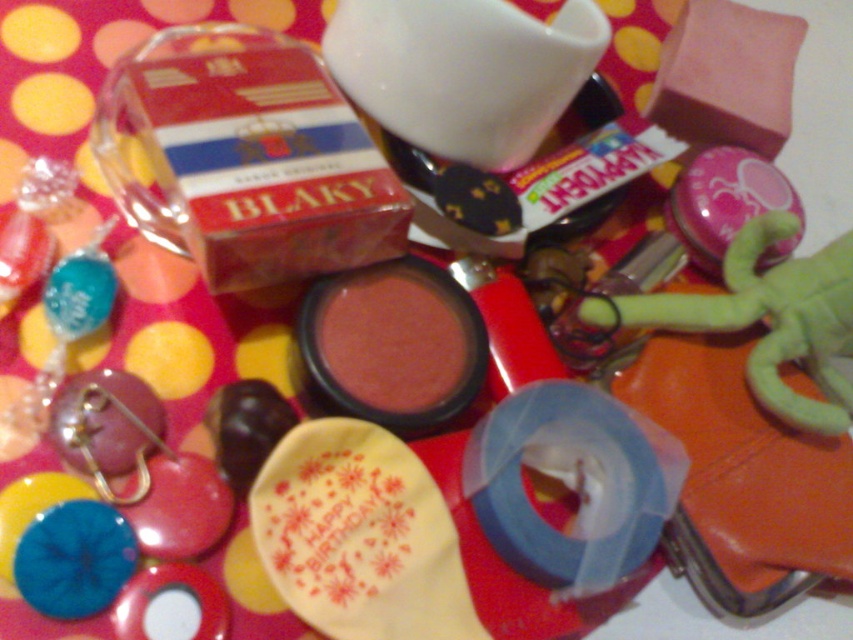
Is point (781, 276) closer to camera compared to point (27, 552)?

No, it is not.

Consider the image. Who is positioned more to the left, green plush toy at lower right or blue rubber band at lower left?

blue rubber band at lower left is more to the left.

Who is more forward, (769,237) or (99,573)?

Point (99,573)

Where is `green plush toy at lower right`? green plush toy at lower right is located at coordinates (766, 320).